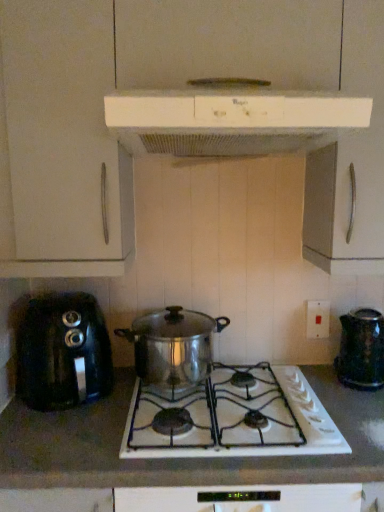
Question: Is black plastic toaster at left, positioned as the 4th kitchen appliance in right-to-left order, wider or thinner than white ceramic stove at center?

Choices:
 (A) thin
 (B) wide

Answer: (A)

Question: From a real-world perspective, is black plastic toaster at left, positioned as the 4th kitchen appliance in right-to-left order, positioned above or below white ceramic stove at center?

Choices:
 (A) below
 (B) above

Answer: (B)

Question: Which is nearer to the white plastic electric outlet at right?

Choices:
 (A) white glossy gas stove at center
 (B) white plastic range hood at upper center, marked as the second kitchen appliance in a right-to-left arrangement
 (C) shiny metallic kettle at right, acting as the 1th kitchen appliance starting from the right
 (D) black plastic toaster at left, positioned as the 4th kitchen appliance in right-to-left order
 (E) shiny metallic pot at center, which ranks as the 3th kitchen appliance in right-to-left order

Answer: (C)

Question: Which object is the farthest from the shiny metallic kettle at right, acting as the 1th kitchen appliance starting from the right?

Choices:
 (A) white glossy gas stove at center
 (B) white plastic range hood at upper center, the 4th kitchen appliance ordered from the bottom
 (C) white plastic electric outlet at right
 (D) black plastic toaster at left, positioned as the 4th kitchen appliance in right-to-left order
 (E) shiny metallic pot at center, arranged as the third kitchen appliance when ordered from the bottom

Answer: (D)